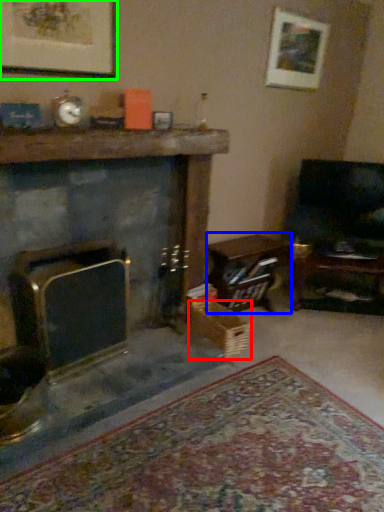
Question: Which object is the closest to the crate (highlighted by a red box)? Choose among these: table (highlighted by a blue box) or picture frame (highlighted by a green box).

Choices:
 (A) table
 (B) picture frame

Answer: (A)